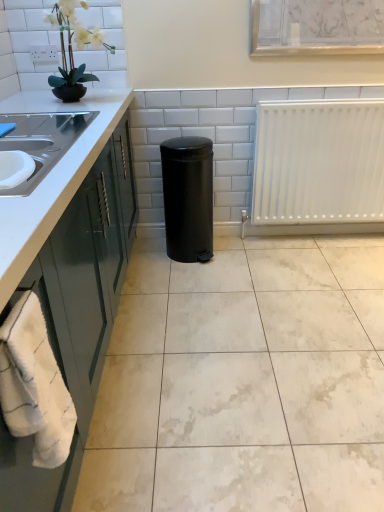
Question: Considering the relative positions of matte black pot at upper left and white matte radiator at right in the image provided, is matte black pot at upper left in front of white matte radiator at right?

Choices:
 (A) yes
 (B) no

Answer: (A)

Question: Can you confirm if matte black pot at upper left is positioned to the left of white matte radiator at right?

Choices:
 (A) no
 (B) yes

Answer: (B)

Question: Can you confirm if matte black pot at upper left is bigger than white matte radiator at right?

Choices:
 (A) yes
 (B) no

Answer: (B)

Question: From a real-world perspective, is matte black pot at upper left on top of white matte radiator at right?

Choices:
 (A) yes
 (B) no

Answer: (A)

Question: Is matte black pot at upper left facing away from white matte radiator at right?

Choices:
 (A) no
 (B) yes

Answer: (A)

Question: In terms of height, does white glossy tile at center look taller or shorter compared to white fluffy bath towel at lower left?

Choices:
 (A) tall
 (B) short

Answer: (B)

Question: Is white glossy tile at center to the left or to the right of white fluffy bath towel at lower left in the image?

Choices:
 (A) right
 (B) left

Answer: (A)

Question: Do you think white glossy tile at center is within white fluffy bath towel at lower left, or outside of it?

Choices:
 (A) inside
 (B) outside

Answer: (B)

Question: Considering the positions of white glossy tile at center and white fluffy bath towel at lower left in the image, is white glossy tile at center bigger or smaller than white fluffy bath towel at lower left?

Choices:
 (A) big
 (B) small

Answer: (A)

Question: In terms of width, does white fluffy bath towel at lower left look wider or thinner when compared to black matte trash can at center?

Choices:
 (A) wide
 (B) thin

Answer: (B)

Question: From a real-world perspective, is white fluffy bath towel at lower left positioned above or below black matte trash can at center?

Choices:
 (A) below
 (B) above

Answer: (B)

Question: In terms of height, does white fluffy bath towel at lower left look taller or shorter compared to black matte trash can at center?

Choices:
 (A) tall
 (B) short

Answer: (B)

Question: Visually, is white fluffy bath towel at lower left positioned to the left or to the right of black matte trash can at center?

Choices:
 (A) right
 (B) left

Answer: (B)

Question: In terms of width, does matte black pot at upper left look wider or thinner when compared to white matte radiator at right?

Choices:
 (A) wide
 (B) thin

Answer: (A)

Question: From a real-world perspective, is matte black pot at upper left physically located above or below white matte radiator at right?

Choices:
 (A) below
 (B) above

Answer: (B)